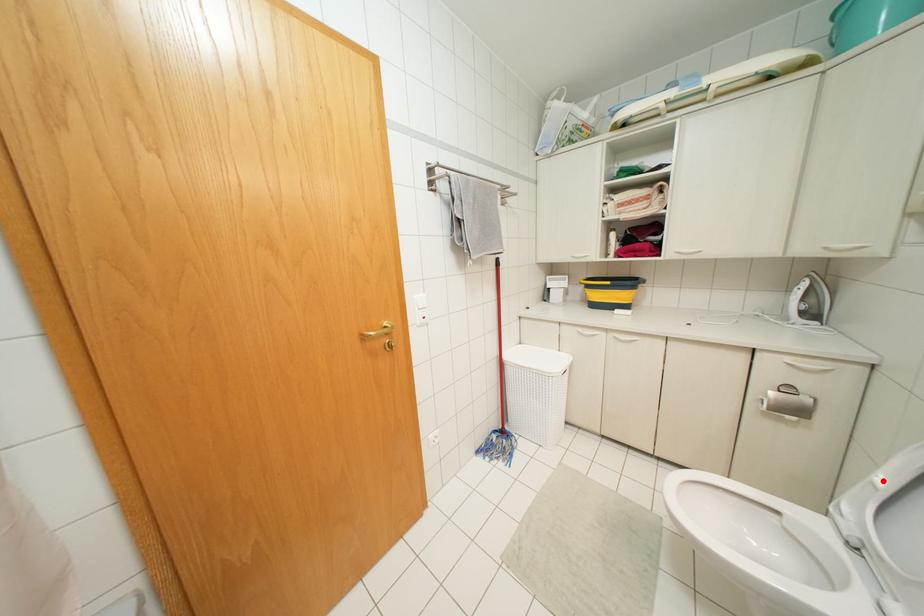
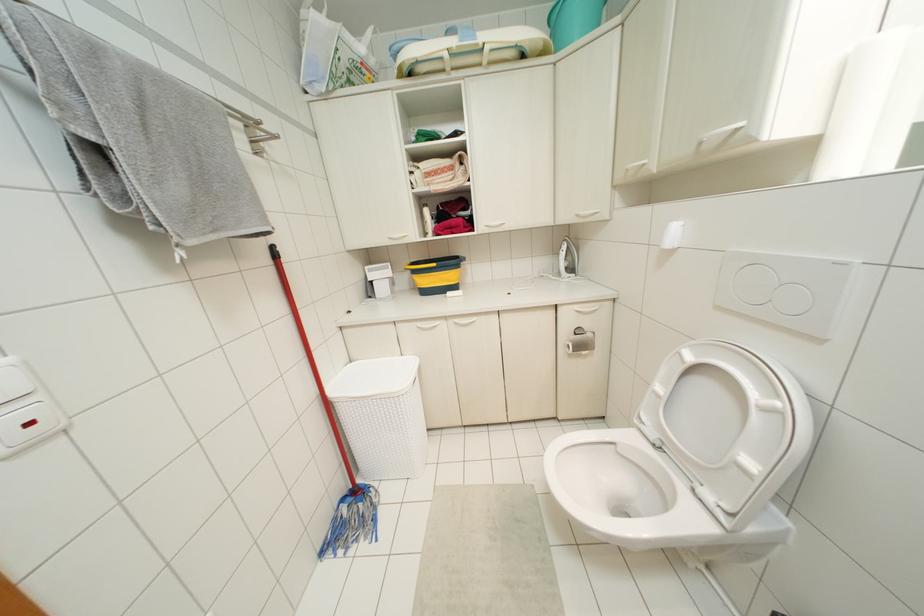
Where in the second image is the point corresponding to the highlighted location from the first image?

(659, 387)